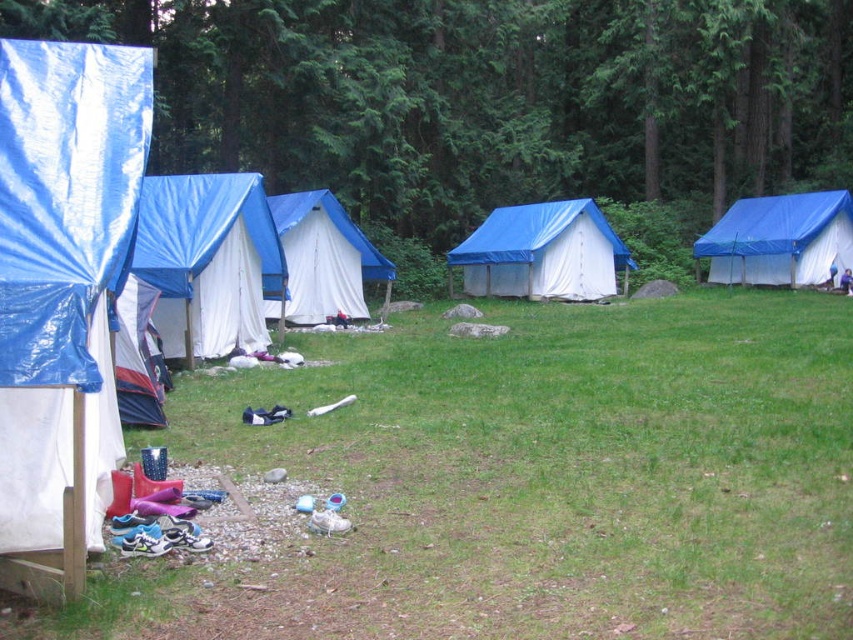
Who is taller, blue tarpaulin tent at center or white canvas tent at left?

Standing taller between the two is white canvas tent at left.

Between blue tarpaulin tent at center and white canvas tent at left, which one is positioned higher?

blue tarpaulin tent at center is higher up.

The image size is (853, 640). Identify the location of blue tarpaulin tent at center. click(543, 252).

Locate an element on the screen. blue tarpaulin tent at center is located at coordinates (543, 252).

Is blue tarpaulin tent at left bigger than blue tarpaulin tent at center?

Yes, blue tarpaulin tent at left is bigger than blue tarpaulin tent at center.

Which of these two, blue tarpaulin tent at left or blue tarpaulin tent at center, stands shorter?

Standing shorter between the two is blue tarpaulin tent at center.

Is point (99, 372) farther from viewer compared to point (480, 292)?

No, (99, 372) is closer to viewer.

Locate an element on the screen. The image size is (853, 640). blue tarpaulin tent at left is located at coordinates (62, 296).

Does green grass at lower left have a greater width compared to blue tarpaulin tent at center-left?

Indeed, green grass at lower left has a greater width compared to blue tarpaulin tent at center-left.

Looking at this image, between green grass at lower left and blue tarpaulin tent at center-left, which one has more height?

green grass at lower left is taller.

Does point (486, 506) come closer to viewer compared to point (260, 195)?

Yes, it is.

At what (x,y) coordinates should I click in order to perform the action: click on green grass at lower left. Please return your answer as a coordinate pair (x, y). This screenshot has height=640, width=853. Looking at the image, I should click on (538, 483).